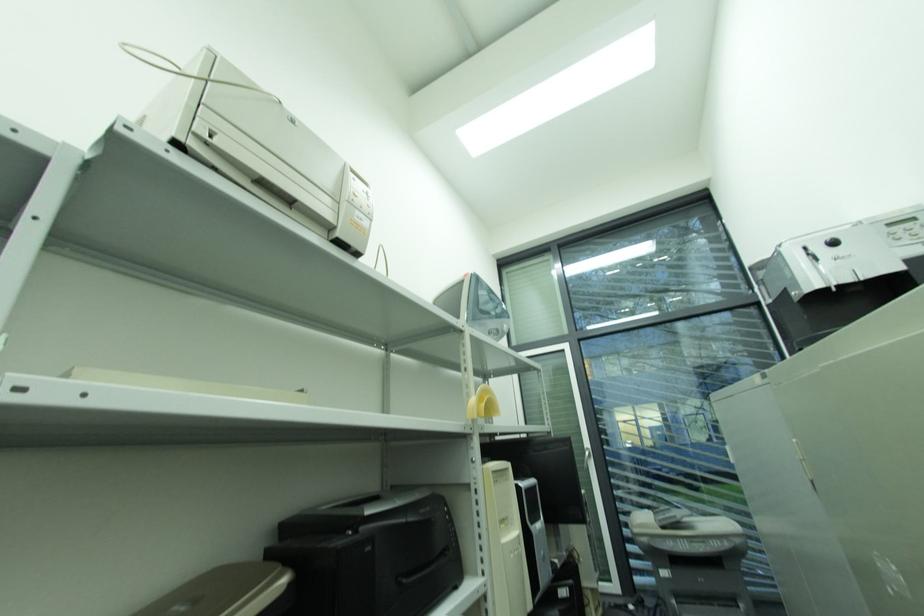
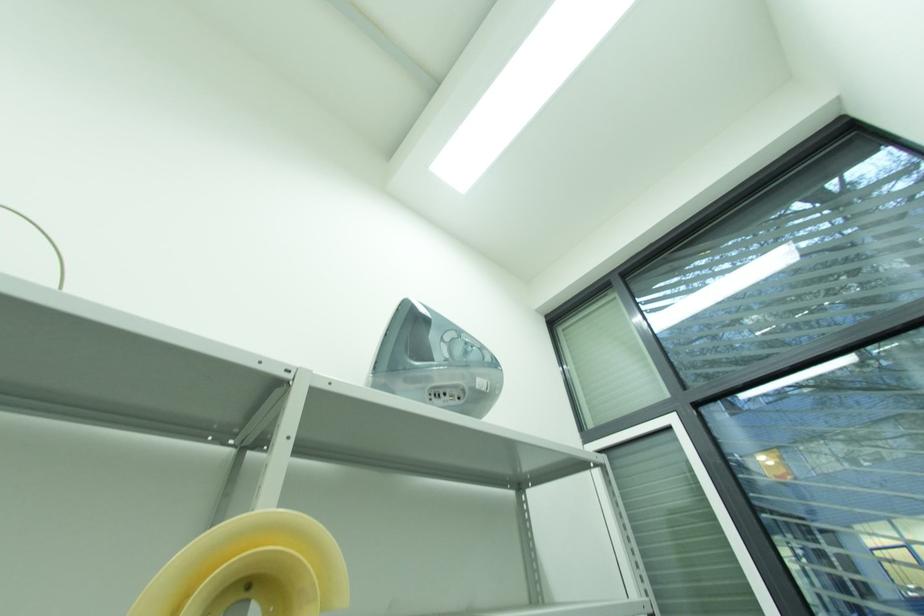
Consider the image. The first image is from the beginning of the video and the second image is from the end. How did the camera likely rotate when shooting the video?

The rotation direction of the camera is left-up.